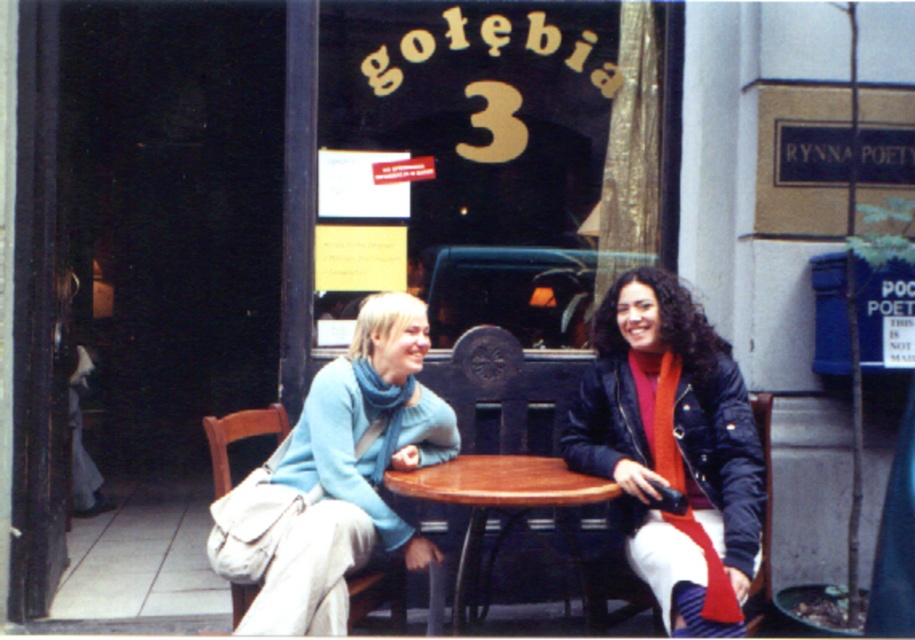
Question: Is the position of light blue sweater at center more distant than that of wooden table at center?

Choices:
 (A) yes
 (B) no

Answer: (B)

Question: Can you confirm if matte black jacket at center is bigger than light blue sweater at center?

Choices:
 (A) no
 (B) yes

Answer: (A)

Question: Which of the following is the farthest from the observer?

Choices:
 (A) light blue sweater at center
 (B) wooden table at center
 (C) matte black jacket at center

Answer: (B)

Question: Considering the real-world distances, which object is closest to the wooden table at center?

Choices:
 (A) light blue sweater at center
 (B) matte black jacket at center

Answer: (A)

Question: Is matte black jacket at center closer to camera compared to light blue sweater at center?

Choices:
 (A) no
 (B) yes

Answer: (A)

Question: Among these objects, which one is farthest from the camera?

Choices:
 (A) light blue sweater at center
 (B) wooden table at center

Answer: (B)